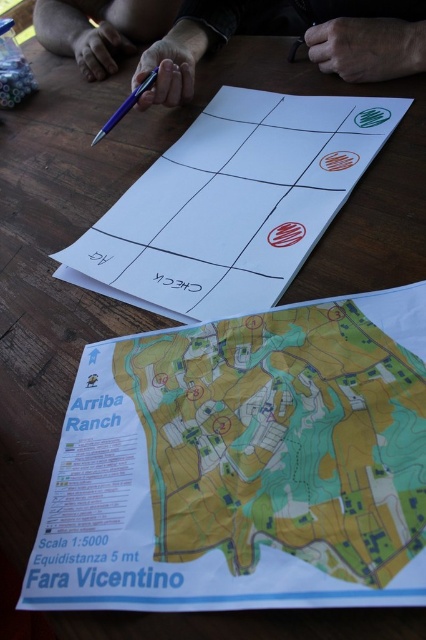
Question: Is white paper at center to the left of matte black pen at upper center from the viewer's perspective?

Choices:
 (A) no
 (B) yes

Answer: (B)

Question: Which point is farther to the camera?

Choices:
 (A) metallic purple pen at center
 (B) white paper at center

Answer: (A)

Question: Can you confirm if matte black pen at upper center is positioned above matte purple pen at upper center?

Choices:
 (A) yes
 (B) no

Answer: (B)

Question: Which point is closer to the camera taking this photo?

Choices:
 (A) (85, 28)
 (B) (184, 230)
 (C) (146, 106)
 (D) (402, 365)

Answer: (D)

Question: Is white paper at center positioned at the back of metallic purple pen at center?

Choices:
 (A) no
 (B) yes

Answer: (A)

Question: Considering the real-world distances, which object is farthest from the matte purple pen at upper center?

Choices:
 (A) matte black pen at upper center
 (B) metallic purple pen at center
 (C) white paper at center
 (D) green paper map at center

Answer: (D)